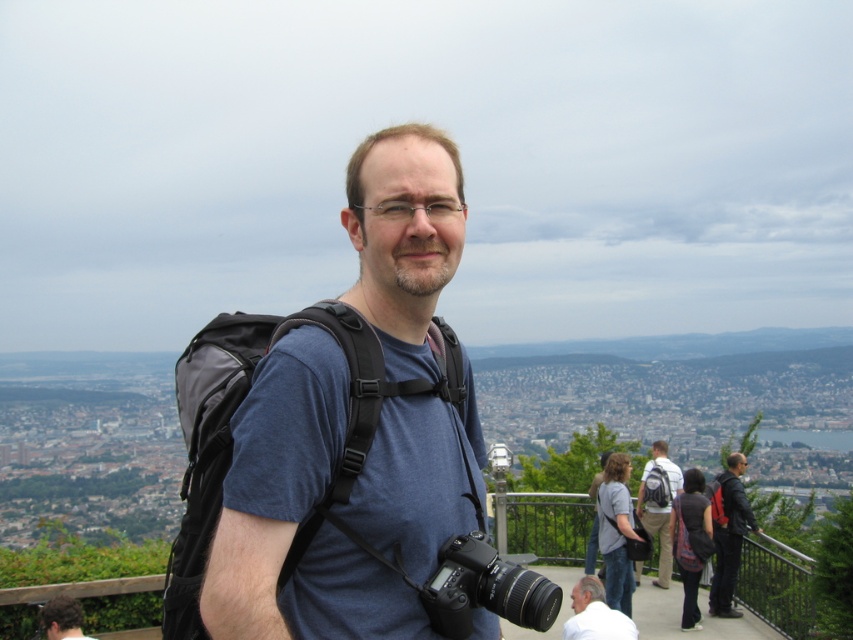
You are planning to take a photo of the white matte shirt at lower right and the black fabric backpack at right. Which object should you focus on first if you want to capture both in the same frame without moving the camera?

The white matte shirt at lower right is larger in size compared to the black fabric backpack at right, so focusing on the white matte shirt at lower right first would ensure it is sharp while the backpack remains in the frame.

Based on the photo, you are trying to decide whether to wear a wider belt. You see the matte black backpack at center and the matte blue shirt at center in the image. Which object can help you determine if your belt will fit?

The matte black backpack at center has a larger width than the matte blue shirt at center. Since the backpack is wider, you can use its width as a reference to see if your belt will fit.

You are a photographer who wants to take a photo of the cityscape without any people in the frame. You are currently holding the black plastic camera at center. The white matte shirt at lower right is blocking your view. Can you move closer to the camera to get a better angle without moving the camera itself?

The distance between the black plastic camera at center and the white matte shirt at lower right is 48.16 meters. Since the shirt is much farther away, moving closer to the camera won